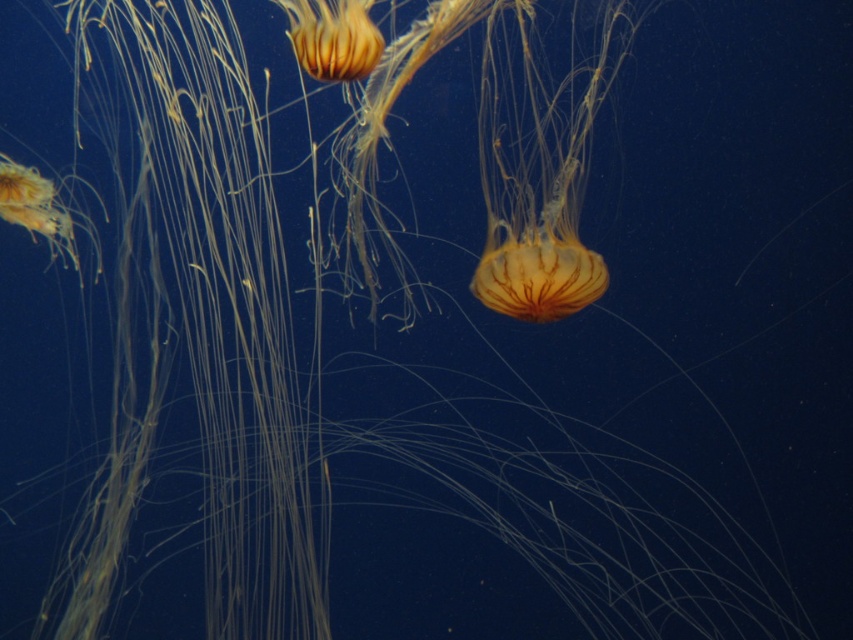
Question: Observing the image, what is the correct spatial positioning of translucent orange jellyfish at center in reference to translucent orange jellyfish at upper center?

Choices:
 (A) above
 (B) below

Answer: (B)

Question: Is translucent orange jellyfish at center closer to the viewer compared to translucent orange jellyfish at upper center?

Choices:
 (A) no
 (B) yes

Answer: (A)

Question: Which point appears farthest from the camera in this image?

Choices:
 (A) (496, 294)
 (B) (294, 13)

Answer: (A)

Question: Which point is closer to the camera?

Choices:
 (A) translucent orange jellyfish at upper center
 (B) translucent orange jellyfish at center

Answer: (A)

Question: Does translucent orange jellyfish at center lie in front of translucent orange jellyfish at upper center?

Choices:
 (A) yes
 (B) no

Answer: (B)